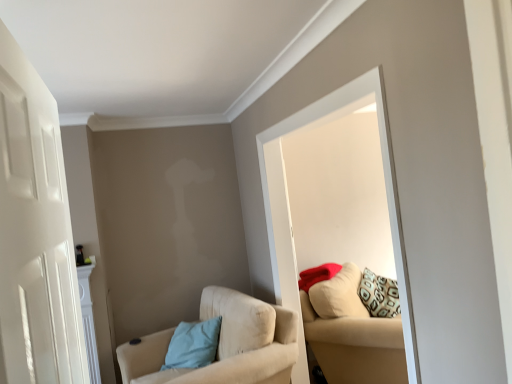
Question: Is white matte door at left with beige fabric couch at right?

Choices:
 (A) yes
 (B) no

Answer: (B)

Question: Considering the relative sizes of white matte door at left and beige fabric couch at right in the image provided, is white matte door at left shorter than beige fabric couch at right?

Choices:
 (A) no
 (B) yes

Answer: (B)

Question: Can beige fabric couch at right be found inside white matte door at left?

Choices:
 (A) yes
 (B) no

Answer: (B)

Question: From the image's perspective, is white matte door at left on beige fabric couch at right?

Choices:
 (A) yes
 (B) no

Answer: (A)

Question: From a real-world perspective, is white matte door at left positioned under beige fabric couch at right based on gravity?

Choices:
 (A) no
 (B) yes

Answer: (A)

Question: Is white matte door at left aimed at beige fabric couch at right?

Choices:
 (A) no
 (B) yes

Answer: (A)

Question: Would you consider beige fabric chair at lower left to be distant from white matte door at left?

Choices:
 (A) yes
 (B) no

Answer: (A)

Question: Is beige fabric chair at lower left to the left of white matte door at left from the viewer's perspective?

Choices:
 (A) yes
 (B) no

Answer: (B)

Question: Is beige fabric chair at lower left taller than white matte door at left?

Choices:
 (A) yes
 (B) no

Answer: (A)

Question: From a real-world perspective, is beige fabric chair at lower left under white matte door at left?

Choices:
 (A) yes
 (B) no

Answer: (A)

Question: Does beige fabric chair at lower left lie behind white matte door at left?

Choices:
 (A) yes
 (B) no

Answer: (A)

Question: Is white matte door at left completely or partially inside beige fabric chair at lower left?

Choices:
 (A) no
 (B) yes

Answer: (A)

Question: From a real-world perspective, is beige fabric couch at right located beneath white glossy mirror at upper center?

Choices:
 (A) yes
 (B) no

Answer: (A)